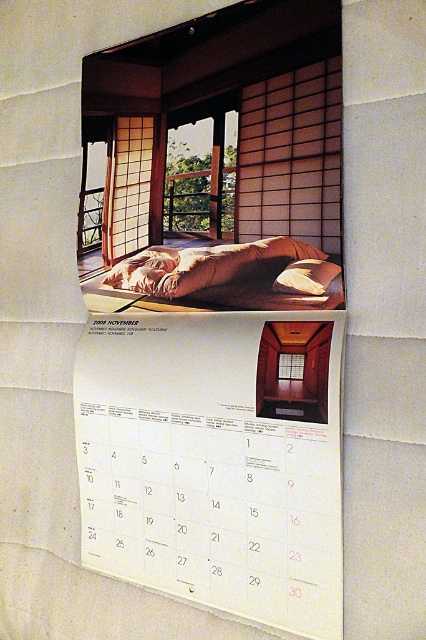
This screenshot has height=640, width=426. What do you see at coordinates (310, 278) in the screenshot?
I see `suede-like beige pillow at center` at bounding box center [310, 278].

Between point (336, 292) and point (288, 369), which one is positioned in front?

Point (336, 292) is more forward.

Find the location of a particular element. The height and width of the screenshot is (640, 426). suede-like beige pillow at center is located at coordinates (310, 278).

This screenshot has height=640, width=426. Identify the location of white paper calendar at center. (215, 464).

Who is shorter, white paper calendar at center or suede-like beige pillow at center?

Standing shorter between the two is suede-like beige pillow at center.

Who is more distant from viewer, (204,384) or (322,280)?

Point (204,384)

This screenshot has width=426, height=640. What are the coordinates of `white paper calendar at center` in the screenshot? It's located at (215, 464).

Who is taller, white paper calendar at center or matte wood window at center?

white paper calendar at center

Does white paper calendar at center have a lesser width compared to matte wood window at center?

No, white paper calendar at center is not thinner than matte wood window at center.

Find the location of a particular element. This screenshot has width=426, height=640. white paper calendar at center is located at coordinates (215, 464).